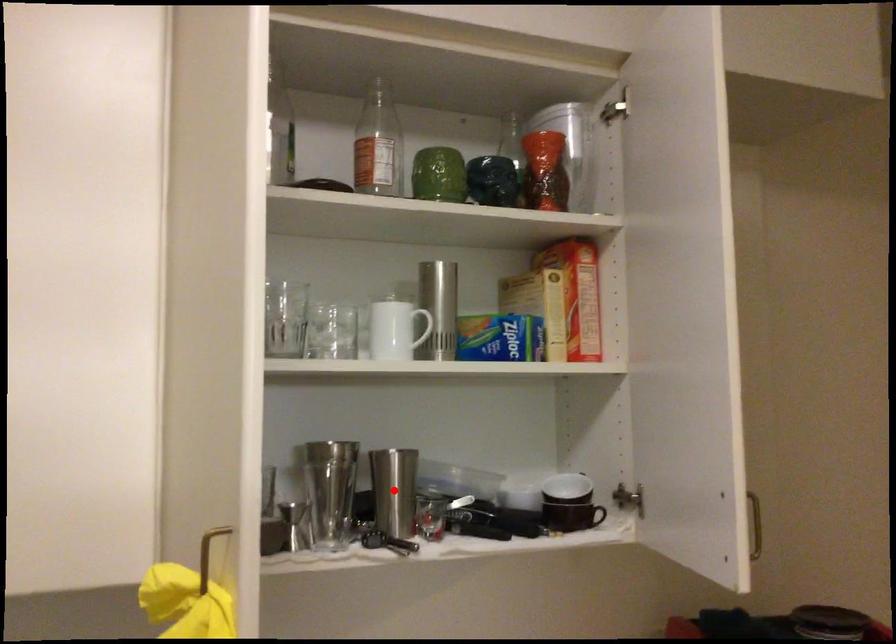
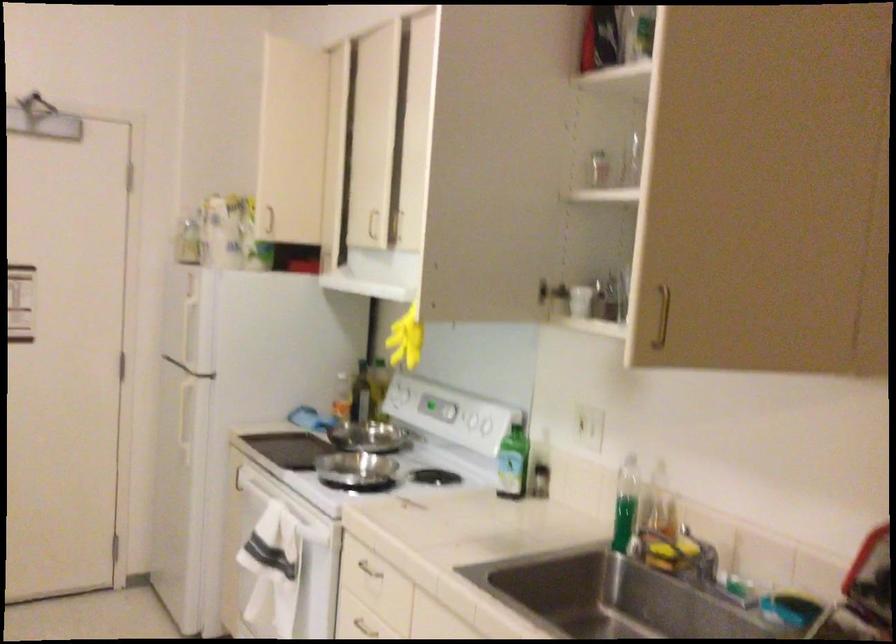
Question: I am providing you with two images of the same scene from different viewpoints. A red point is marked on the first image. Is the red point's position out of view in image 2?

Choices:
 (A) Yes
 (B) No

Answer: (A)